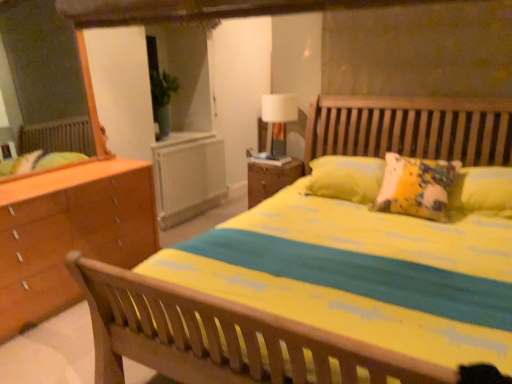
Question: Should I look upward or downward to see white fabric-covered lamp at upper center?

Choices:
 (A) up
 (B) down

Answer: (A)

Question: Considering the relative sizes of white plastic radiator at center and white fabric-covered lamp at upper center in the image provided, is white plastic radiator at center smaller than white fabric-covered lamp at upper center?

Choices:
 (A) no
 (B) yes

Answer: (A)

Question: Considering the relative sizes of white plastic radiator at center and white fabric-covered lamp at upper center in the image provided, is white plastic radiator at center shorter than white fabric-covered lamp at upper center?

Choices:
 (A) no
 (B) yes

Answer: (A)

Question: Is white plastic radiator at center in front of white fabric-covered lamp at upper center?

Choices:
 (A) no
 (B) yes

Answer: (A)

Question: Is white plastic radiator at center turned away from white fabric-covered lamp at upper center?

Choices:
 (A) no
 (B) yes

Answer: (A)

Question: From a real-world perspective, is white plastic radiator at center on white fabric-covered lamp at upper center?

Choices:
 (A) no
 (B) yes

Answer: (A)

Question: Considering the relative positions of white plastic radiator at center and white fabric-covered lamp at upper center in the image provided, is white plastic radiator at center to the right of white fabric-covered lamp at upper center from the viewer's perspective?

Choices:
 (A) yes
 (B) no

Answer: (B)

Question: From a real-world perspective, is white fabric-covered lamp at upper center beneath white plastic radiator at center?

Choices:
 (A) yes
 (B) no

Answer: (B)

Question: From a real-world perspective, is white fabric-covered lamp at upper center on white plastic radiator at center?

Choices:
 (A) yes
 (B) no

Answer: (A)

Question: Does white fabric-covered lamp at upper center have a greater height compared to white plastic radiator at center?

Choices:
 (A) no
 (B) yes

Answer: (A)

Question: Is white fabric-covered lamp at upper center directly adjacent to white plastic radiator at center?

Choices:
 (A) yes
 (B) no

Answer: (B)

Question: Is white fabric-covered lamp at upper center further to the viewer compared to white plastic radiator at center?

Choices:
 (A) no
 (B) yes

Answer: (A)

Question: Is white plastic radiator at center completely or partially inside white fabric-covered lamp at upper center?

Choices:
 (A) yes
 (B) no

Answer: (B)

Question: Is wooden nightstand at center positioned in front of white plastic radiator at center?

Choices:
 (A) no
 (B) yes

Answer: (B)